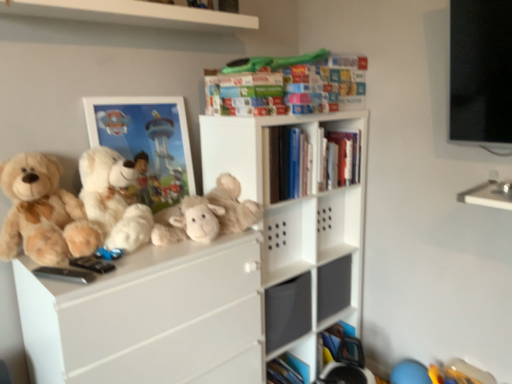
Question: Should I look upward or downward to see fluffy beige stuffed animal at center?

Choices:
 (A) up
 (B) down

Answer: (B)

Question: Does soft beige teddy bear at left, which ranks as the 2th teddy bear in right-to-left order, have a smaller size compared to multicolored cardboard book at upper center, which appears as the second book when ordered from the bottom?

Choices:
 (A) yes
 (B) no

Answer: (B)

Question: Does soft beige teddy bear at left, which is the first teddy bear from left to right, appear on the left side of multicolored cardboard book at upper center, which is counted as the 1th book, starting from the top?

Choices:
 (A) yes
 (B) no

Answer: (A)

Question: From the image's perspective, is soft beige teddy bear at left, which ranks as the 2th teddy bear in right-to-left order, over multicolored cardboard book at upper center, which is counted as the 1th book, starting from the top?

Choices:
 (A) yes
 (B) no

Answer: (B)

Question: Is soft beige teddy bear at left, which ranks as the 2th teddy bear in right-to-left order, far away from multicolored cardboard book at upper center, which is counted as the 1th book, starting from the top?

Choices:
 (A) yes
 (B) no

Answer: (B)

Question: Considering the relative sizes of soft beige teddy bear at left, which ranks as the 2th teddy bear in right-to-left order, and multicolored cardboard book at upper center, which appears as the second book when ordered from the bottom, in the image provided, is soft beige teddy bear at left, which ranks as the 2th teddy bear in right-to-left order, shorter than multicolored cardboard book at upper center, which appears as the second book when ordered from the bottom,?

Choices:
 (A) yes
 (B) no

Answer: (B)

Question: Is soft beige teddy bear at left, which ranks as the 2th teddy bear in right-to-left order, behind multicolored cardboard book at upper center, which is counted as the 1th book, starting from the top?

Choices:
 (A) yes
 (B) no

Answer: (B)

Question: Considering the relative positions of fluffy beige stuffed animal at center and soft beige teddy bear at left, which is the first teddy bear from left to right, in the image provided, is fluffy beige stuffed animal at center to the left of soft beige teddy bear at left, which is the first teddy bear from left to right, from the viewer's perspective?

Choices:
 (A) no
 (B) yes

Answer: (A)

Question: Does fluffy beige stuffed animal at center touch soft beige teddy bear at left, which ranks as the 2th teddy bear in right-to-left order?

Choices:
 (A) yes
 (B) no

Answer: (B)

Question: From a real-world perspective, is fluffy beige stuffed animal at center located beneath soft beige teddy bear at left, which is the first teddy bear from left to right?

Choices:
 (A) no
 (B) yes

Answer: (B)

Question: From a real-world perspective, is fluffy beige stuffed animal at center located higher than soft beige teddy bear at left, which is the first teddy bear from left to right?

Choices:
 (A) no
 (B) yes

Answer: (A)

Question: Can we say fluffy beige stuffed animal at center lies outside soft beige teddy bear at left, which is the first teddy bear from left to right?

Choices:
 (A) no
 (B) yes

Answer: (B)

Question: Does fluffy beige stuffed animal at center lie behind soft beige teddy bear at left, which ranks as the 2th teddy bear in right-to-left order?

Choices:
 (A) no
 (B) yes

Answer: (B)

Question: Is fluffy beige stuffed animal at center next to multicolored cardboard book at upper center, which is counted as the 1th book, starting from the top, and touching it?

Choices:
 (A) yes
 (B) no

Answer: (B)